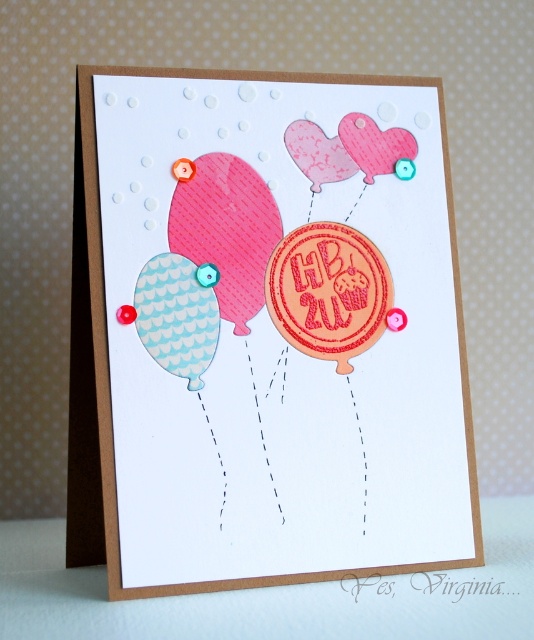
Who is taller, matte pink balloon at center or light blue textured balloon at left?

matte pink balloon at center

Between matte pink balloon at center and light blue textured balloon at left, which one has less height?

light blue textured balloon at left is shorter.

What are the coordinates of `matte pink balloon at center` in the screenshot? It's located at (271, 336).

Does point (217, 141) lie behind point (264, 200)?

No, it is in front of (264, 200).

This screenshot has height=640, width=534. Describe the element at coordinates (271, 336) in the screenshot. I see `matte pink balloon at center` at that location.

The height and width of the screenshot is (640, 534). In order to click on matte pink balloon at center in this screenshot , I will do `click(271, 336)`.

Can you confirm if light blue textured balloon at left is taller than textured pink heart at upper center?

Yes.

Does light blue textured balloon at left appear under textured pink heart at upper center?

Yes.

Does point (175, 280) come farther from viewer compared to point (310, 122)?

No, (175, 280) is in front of (310, 122).

Where is `light blue textured balloon at left`? Image resolution: width=534 pixels, height=640 pixels. light blue textured balloon at left is located at coordinates (176, 316).